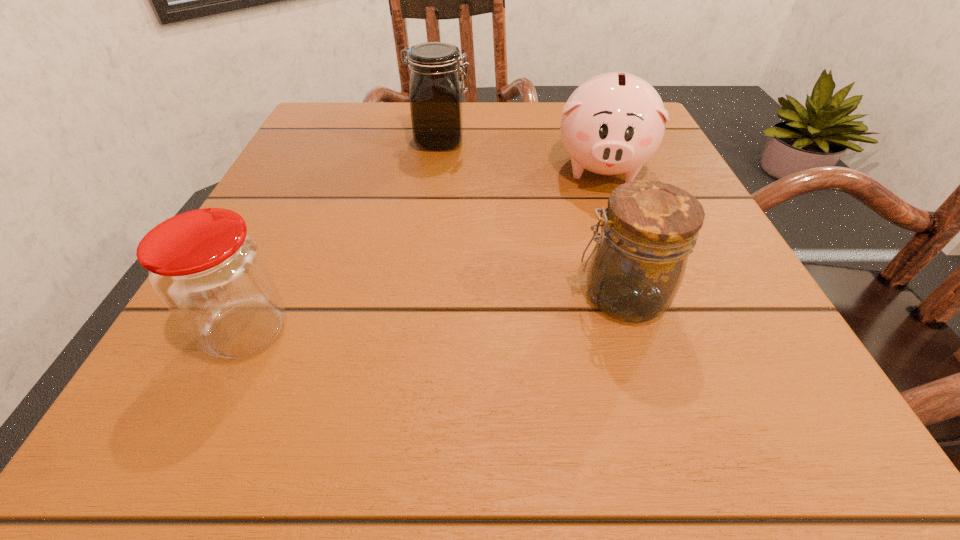
The width and height of the screenshot is (960, 540). Find the location of `vacant space at the far left corner`. vacant space at the far left corner is located at coordinates (342, 154).

Locate an element on the screen. This screenshot has width=960, height=540. free point at the far right corner is located at coordinates (661, 153).

The width and height of the screenshot is (960, 540). Find the location of `unoccupied area between the second object from left to right and the leftmost object`. unoccupied area between the second object from left to right and the leftmost object is located at coordinates (344, 236).

Locate an element on the screen. This screenshot has width=960, height=540. blank region between the leftmost jar and the second jar from right to left is located at coordinates (344, 236).

Where is `free area in between the piggy bank and the leftmost object`? free area in between the piggy bank and the leftmost object is located at coordinates (424, 249).

Image resolution: width=960 pixels, height=540 pixels. Identify the location of unoccupied position between the rightmost jar and the second object from left to right. (531, 218).

Identify the location of unoccupied area between the farthest jar and the rightmost jar. (531, 218).

What are the coordinates of `vacant area that lies between the leftmost jar and the rightmost jar` in the screenshot? It's located at (434, 314).

Identify the location of vacant region between the leftmost jar and the rightmost jar. This screenshot has width=960, height=540. (434, 314).

Locate an element on the screen. The image size is (960, 540). empty space that is in between the second object from left to right and the piggy bank is located at coordinates (520, 154).